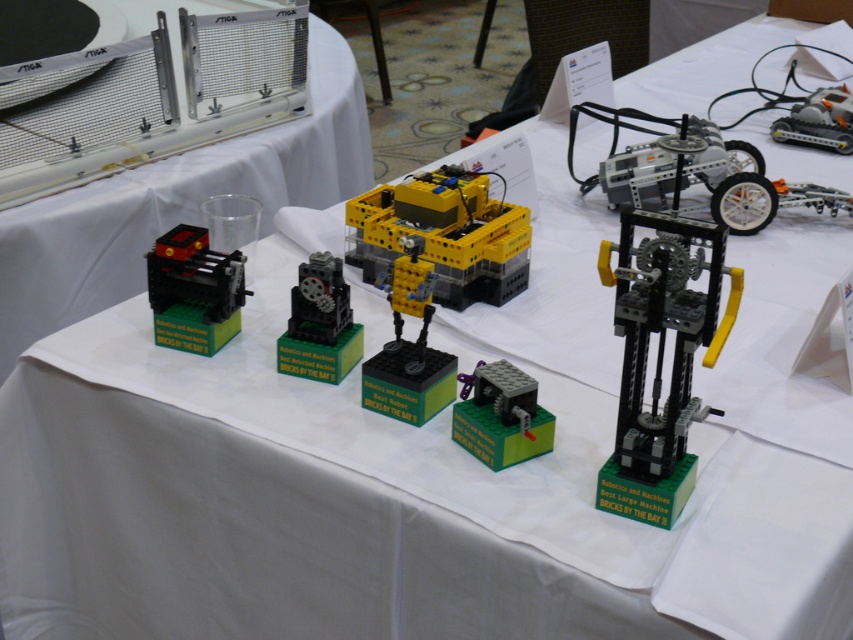
Looking at this image, who is positioned more to the left, translucent gray plastic robot at center or metallic silver airplane at upper right?

From the viewer's perspective, translucent gray plastic robot at center appears more on the left side.

Does translucent gray plastic robot at center lie behind metallic silver airplane at upper right?

No, translucent gray plastic robot at center is closer to the viewer.

Locate an element on the screen. translucent gray plastic robot at center is located at coordinates [x=676, y=168].

Which is behind, point (506, 413) or point (283, 358)?

The point (283, 358) is behind.

Does matte black gear at center have a greater width compared to translucent plastic gear at center?

Correct, the width of matte black gear at center exceeds that of translucent plastic gear at center.

Identify the location of matte black gear at center. (502, 417).

Looking at this image, between matte black machine at left and metallic silver airplane at upper right, which one has less height?

With less height is metallic silver airplane at upper right.

Does matte black machine at left have a lesser width compared to metallic silver airplane at upper right?

Correct, matte black machine at left's width is less than metallic silver airplane at upper right's.

What are the coordinates of `matte black machine at left` in the screenshot? It's located at (194, 291).

You are a GUI agent. You are given a task and a screenshot of the screen. Output one action in this format:
    pyautogui.click(x=<x>, y=<y>)
    Task: Click on the matte black machine at left
    
    Given the screenshot: What is the action you would take?
    pyautogui.click(x=194, y=291)